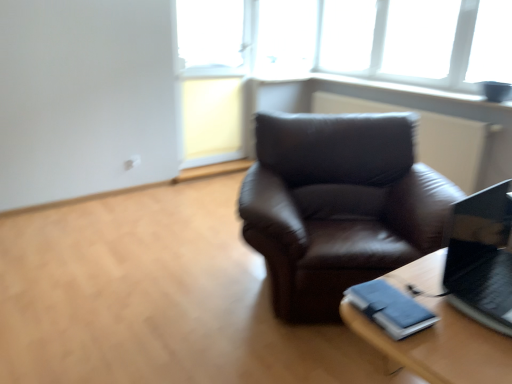
The image size is (512, 384). I want to click on space that is in front of blue fabric binder at lower right, so point(430,350).